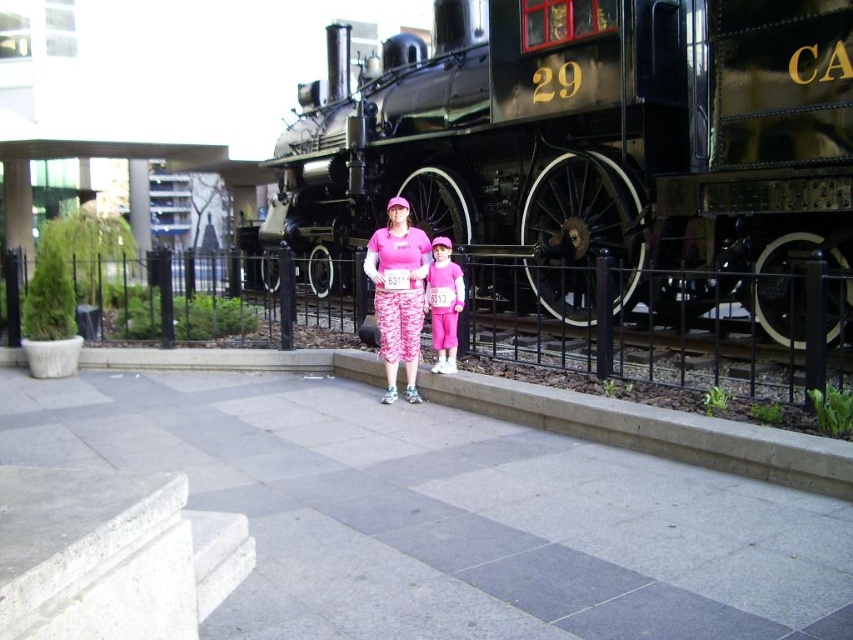
From the picture: Between shiny black locomotive at center and matte pink leggings at center, which one is positioned lower?

Positioned lower is matte pink leggings at center.

How much distance is there between shiny black locomotive at center and matte pink leggings at center?

shiny black locomotive at center is 3.92 meters away from matte pink leggings at center.

Does point (779, 296) come behind point (451, 353)?

That is False.

This screenshot has height=640, width=853. Identify the location of shiny black locomotive at center. (589, 140).

Is black metal train track at center to the right of matte pink leggings at center from the viewer's perspective?

Correct, you'll find black metal train track at center to the right of matte pink leggings at center.

Can you confirm if black metal train track at center is smaller than matte pink leggings at center?

Indeed, black metal train track at center has a smaller size compared to matte pink leggings at center.

Locate an element on the screen. The width and height of the screenshot is (853, 640). black metal train track at center is located at coordinates (639, 342).

Is point (398, 140) closer to camera compared to point (657, 372)?

No, (398, 140) is behind (657, 372).

Is point (628, 129) closer to viewer compared to point (567, 365)?

No, it is not.

Identify the location of shiny black locomotive at center. The width and height of the screenshot is (853, 640). (589, 140).